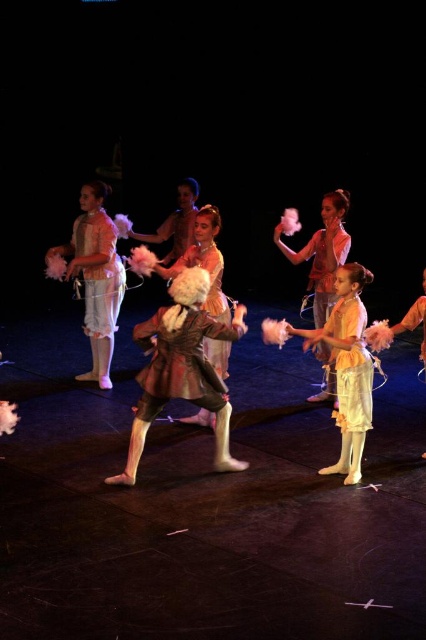
Who is taller, matte pink tutu at center or matte orange dress at center?

Standing taller between the two is matte pink tutu at center.

Based on the photo, is matte pink tutu at center bigger than matte orange dress at center?

Yes, matte pink tutu at center is bigger than matte orange dress at center.

Which is behind, point (80, 250) or point (339, 208)?

The point (80, 250) is behind.

Where is `matte pink tutu at center`? The image size is (426, 640). matte pink tutu at center is located at coordinates (95, 276).

Which is above, matte orange dress at center or shiny silver dress at center?

matte orange dress at center is above.

Who is taller, matte orange dress at center or shiny silver dress at center?

With more height is shiny silver dress at center.

You are a GUI agent. You are given a task and a screenshot of the screen. Output one action in this format:
    pyautogui.click(x=<x>, y=<y>)
    Task: Click on the matte orange dress at center
    This screenshot has height=640, width=426.
    Given the screenshot: What is the action you would take?
    pyautogui.click(x=322, y=252)

Locate an element on the screen. Image resolution: width=426 pixels, height=640 pixels. matte orange dress at center is located at coordinates (322, 252).

Is matte yellow dress at center taller than matte orange dress at center?

Indeed, matte yellow dress at center has a greater height compared to matte orange dress at center.

This screenshot has height=640, width=426. What do you see at coordinates (342, 365) in the screenshot?
I see `matte yellow dress at center` at bounding box center [342, 365].

The image size is (426, 640). I want to click on matte yellow dress at center, so click(342, 365).